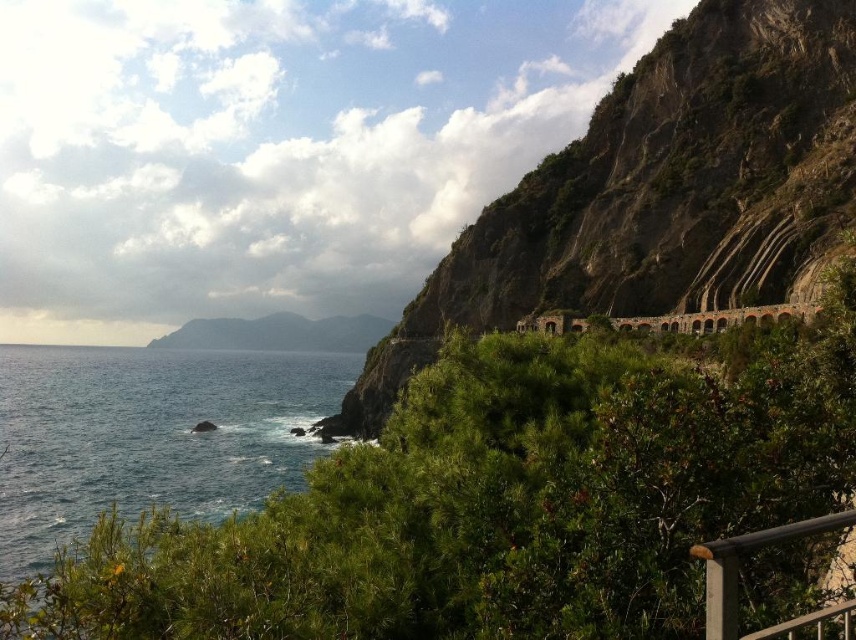
Based on the scene description, where is the blue liquid water at lower left located in terms of its 2D coordinates?

The blue liquid water at lower left is located at the 2D coordinates of point (147,433).

You are standing on the viewing platform near the silver metallic balustrade at lower right. Which direction should you walk to reach the rugged stone cliff at right?

You should walk to your right to reach the rugged stone cliff at right because it is located to the right of the silver metallic balustrade at lower right.

You are a landscape photographer planning to capture the blue liquid water at lower left and the silver metallic balustrade at lower right in a single frame. Given their sizes, which object should you focus on to ensure both are clearly visible in your composition?

The blue liquid water at lower left is larger in size than the silver metallic balustrade at lower right, so you should focus on the blue liquid water at lower left to ensure both objects are clearly visible in your composition.